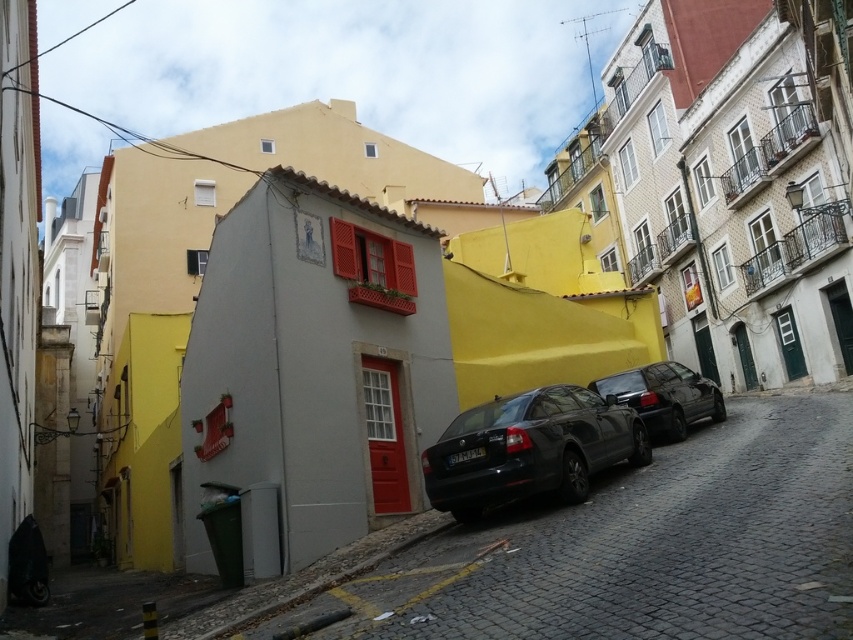
Can you confirm if matte black car at center is smaller than shiny black car at center-right?

No, matte black car at center is not smaller than shiny black car at center-right.

Is point (641, 449) farther from viewer compared to point (666, 384)?

No, it is not.

Find the location of a particular element. The image size is (853, 640). matte black car at center is located at coordinates (531, 449).

Is smooth gray wall at center further to the viewer compared to matte black car at center?

No, it is not.

Does smooth gray wall at center have a larger size compared to matte black car at center?

Correct, smooth gray wall at center is larger in size than matte black car at center.

Is point (427, 612) positioned after point (538, 456)?

No, (427, 612) is in front of (538, 456).

The image size is (853, 640). I want to click on smooth gray wall at center, so click(637, 548).

Is smooth gray wall at center positioned before shiny black car at center-right?

Yes, it is in front of shiny black car at center-right.

Can you confirm if smooth gray wall at center is shorter than shiny black car at center-right?

No, smooth gray wall at center is not shorter than shiny black car at center-right.

Who is more distant from viewer, (x=815, y=406) or (x=675, y=362)?

Point (x=675, y=362)

Where is `smooth gray wall at center`? Image resolution: width=853 pixels, height=640 pixels. smooth gray wall at center is located at coordinates (637, 548).